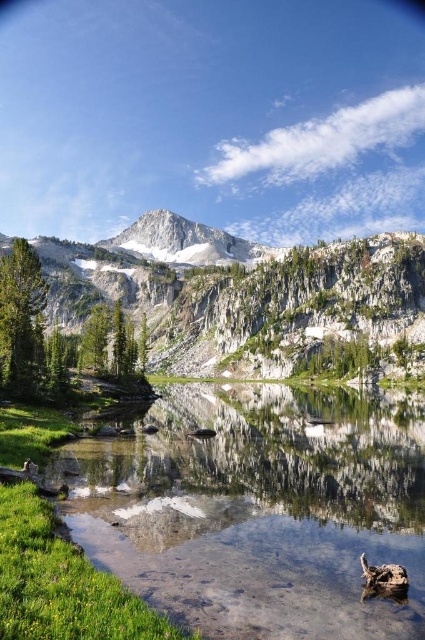
Question: Estimate the real-world distances between objects in this image. Which object is closer to the clear glass pond at center?

Choices:
 (A) white rocky mountain at center
 (B) white snow-covered mountain at center

Answer: (A)

Question: Which point is farther from the camera taking this photo?

Choices:
 (A) (278, 481)
 (B) (164, 248)

Answer: (B)

Question: Estimate the real-world distances between objects in this image. Which object is closer to the white rocky mountain at center?

Choices:
 (A) clear glass pond at center
 (B) white snow-covered mountain at center

Answer: (B)

Question: Does clear glass pond at center come in front of white snow-covered mountain at center?

Choices:
 (A) yes
 (B) no

Answer: (A)

Question: Is clear glass pond at center wider than white rocky mountain at center?

Choices:
 (A) no
 (B) yes

Answer: (A)

Question: Does clear glass pond at center have a greater width compared to white snow-covered mountain at center?

Choices:
 (A) yes
 (B) no

Answer: (B)